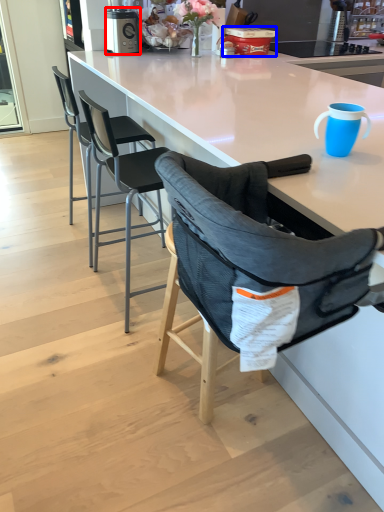
Question: Which object appears farthest to the camera in this image, kitchen appliance (highlighted by a red box) or appliance (highlighted by a blue box)?

Choices:
 (A) kitchen appliance
 (B) appliance

Answer: (B)